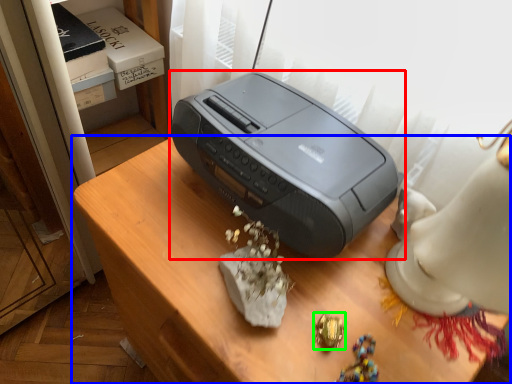
Question: Which object is the farthest from printer (highlighted by a red box)? Choose among these: furniture (highlighted by a blue box) or jewellery (highlighted by a green box).

Choices:
 (A) furniture
 (B) jewellery

Answer: (B)